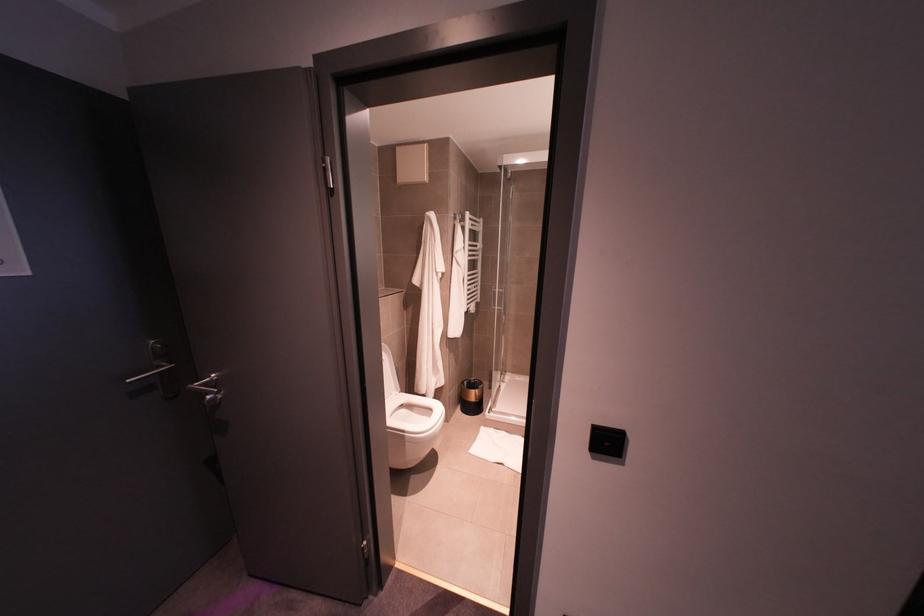
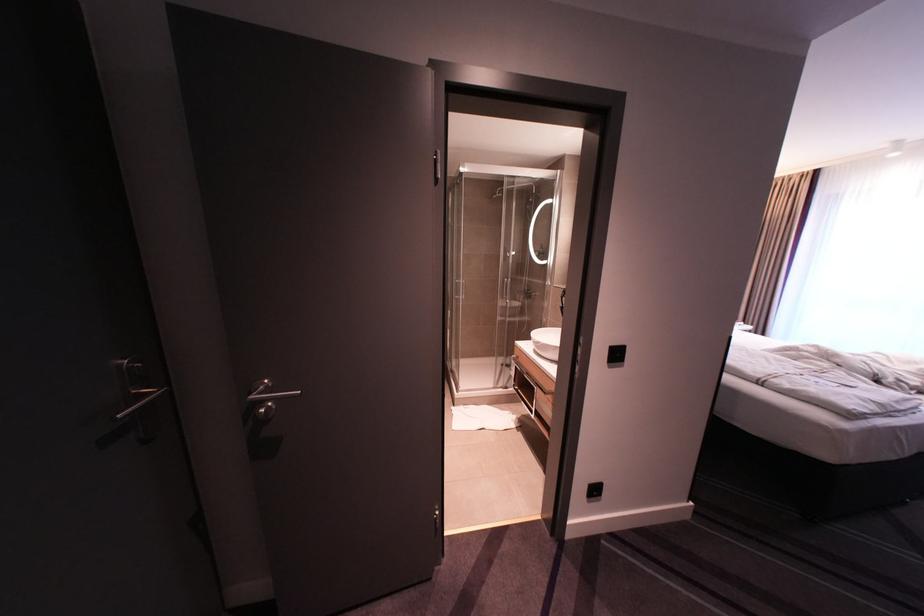
Question: What movement of the cameraman would produce the second image?

Choices:
 (A) Left
 (B) Right
 (C) Forward
 (D) Backward

Answer: (A)